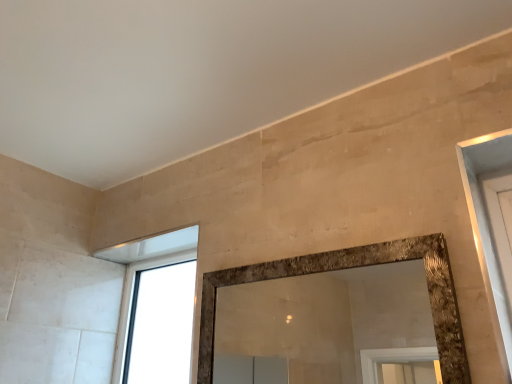
Question: From a real-world perspective, is transparent glass window at upper left positioned above or below beige stone wall at upper center?

Choices:
 (A) below
 (B) above

Answer: (A)

Question: Would you say transparent glass window at upper left is inside or outside beige stone wall at upper center?

Choices:
 (A) outside
 (B) inside

Answer: (A)

Question: Is transparent glass window at upper left taller or shorter than beige stone wall at upper center?

Choices:
 (A) short
 (B) tall

Answer: (B)

Question: Relative to transparent glass window at upper left, is beige stone wall at upper center in front or behind?

Choices:
 (A) behind
 (B) front

Answer: (B)

Question: Is beige stone wall at upper center inside or outside of transparent glass window at upper left?

Choices:
 (A) outside
 (B) inside

Answer: (A)

Question: From a real-world perspective, relative to transparent glass window at upper left, is beige stone wall at upper center vertically above or below?

Choices:
 (A) below
 (B) above

Answer: (B)

Question: Considering the positions of point (206, 105) and point (169, 278), is point (206, 105) closer or farther from the camera than point (169, 278)?

Choices:
 (A) farther
 (B) closer

Answer: (B)